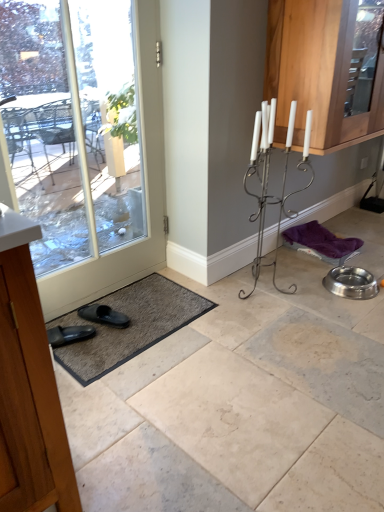
Question: Based on their positions, is wooden cabinet at left, the 1th cabinetry viewed from the left, located to the left or right of clear glass door at lower left?

Choices:
 (A) right
 (B) left

Answer: (B)

Question: From a real-world perspective, is wooden cabinet at left, which appears as the second cabinetry when viewed from the top, above or below clear glass door at lower left?

Choices:
 (A) above
 (B) below

Answer: (B)

Question: Estimate the real-world distances between objects in this image. Which object is farther from the black rubber slipper at lower left?

Choices:
 (A) wooden cabinet at left, the 1th cabinetry viewed from the left
 (B) wooden cabinet at upper right, positioned as the 1th cabinetry in top-to-bottom order
 (C) gray textured bath mat at lower left
 (D) clear glass door at lower left
 (E) metallic silver candle holder at center right

Answer: (B)

Question: Which object is positioned closest to the clear glass door at lower left?

Choices:
 (A) wooden cabinet at left, placed as the second cabinetry when sorted from back to front
 (B) black rubber slipper at lower left
 (C) metallic silver candle holder at center right
 (D) wooden cabinet at upper right, the second cabinetry viewed from the left
 (E) gray textured bath mat at lower left

Answer: (E)